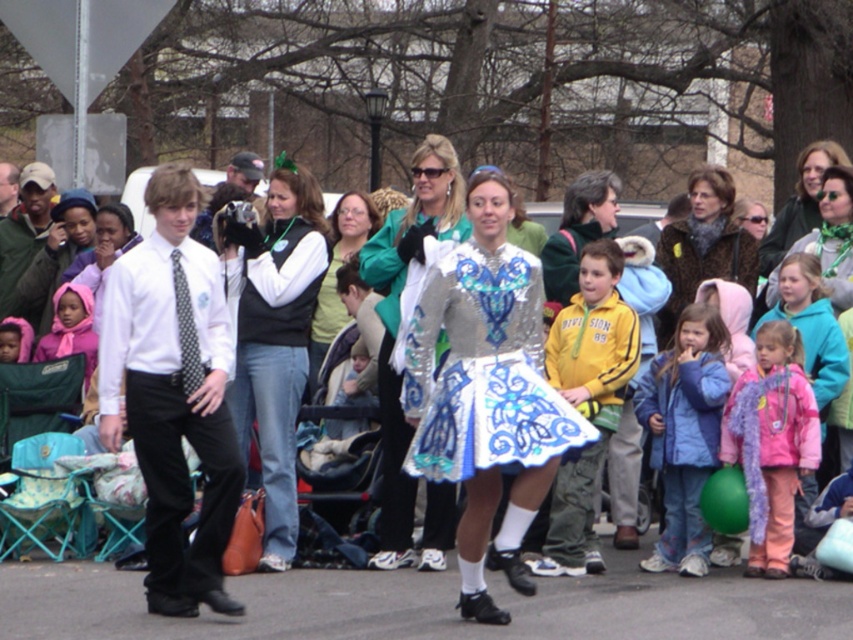
Between point (468, 609) and point (688, 230), which one is positioned in front?

Point (468, 609) is in front.

Between shiny silver dress at center and brown fuzzy coat at center, which one has less height?

brown fuzzy coat at center is shorter.

Find the location of a particular element. The height and width of the screenshot is (640, 853). shiny silver dress at center is located at coordinates 486,392.

Where is `shiny silver dress at center`? This screenshot has width=853, height=640. shiny silver dress at center is located at coordinates (486, 392).

Does point (74, 228) come behind point (90, 360)?

Yes, point (74, 228) is behind point (90, 360).

Is matte black jacket at upper left above matte pink scarf at lower left?

Indeed, matte black jacket at upper left is positioned over matte pink scarf at lower left.

Locate an element on the screen. matte black jacket at upper left is located at coordinates (56, 256).

Between point (560, 419) and point (33, 266), which one is positioned in front?

Point (560, 419) is more forward.

Can you confirm if shiny silver dress at center is positioned to the left of matte black jacket at upper left?

In fact, shiny silver dress at center is to the right of matte black jacket at upper left.

Is point (486, 259) closer to viewer compared to point (44, 269)?

That is True.

Locate an element on the screen. The height and width of the screenshot is (640, 853). shiny silver dress at center is located at coordinates (486, 392).